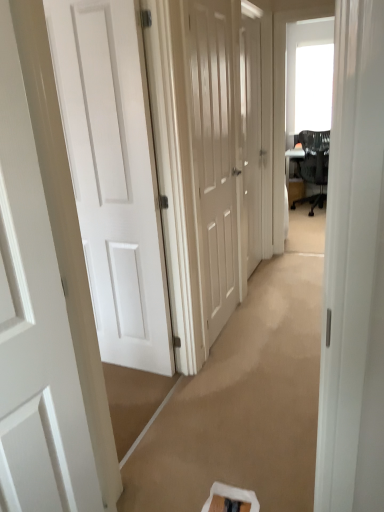
Question: Is black mesh chair at upper right to the right of white matte door at left, which is the third door in back-to-front order, from the viewer's perspective?

Choices:
 (A) no
 (B) yes

Answer: (B)

Question: Is black mesh chair at upper right at the left side of white matte door at left, which is the third door in back-to-front order?

Choices:
 (A) no
 (B) yes

Answer: (A)

Question: From the image's perspective, is black mesh chair at upper right under white matte door at left, which is the third door in back-to-front order?

Choices:
 (A) yes
 (B) no

Answer: (B)

Question: Can you confirm if black mesh chair at upper right is shorter than white matte door at left, acting as the 2th door starting from the front?

Choices:
 (A) yes
 (B) no

Answer: (A)

Question: Is white matte door at left, which is the third door in back-to-front order, a part of black mesh chair at upper right?

Choices:
 (A) no
 (B) yes

Answer: (A)

Question: Considering the positions of white glossy door at left, the first door viewed from the front, and white matte door at left, acting as the 2th door starting from the front, in the image, is white glossy door at left, the first door viewed from the front, bigger or smaller than white matte door at left, acting as the 2th door starting from the front,?

Choices:
 (A) big
 (B) small

Answer: (B)

Question: From their relative heights in the image, would you say white glossy door at left, the first door viewed from the front, is taller or shorter than white matte door at left, acting as the 2th door starting from the front?

Choices:
 (A) short
 (B) tall

Answer: (A)

Question: From a real-world perspective, relative to white matte door at left, which is the third door in back-to-front order, is white glossy door at left, the first door viewed from the front, vertically above or below?

Choices:
 (A) above
 (B) below

Answer: (B)

Question: Considering the positions of white glossy door at left, which is the fourth door in back-to-front order, and white matte door at left, acting as the 2th door starting from the front, in the image, is white glossy door at left, which is the fourth door in back-to-front order, wider or thinner than white matte door at left, acting as the 2th door starting from the front,?

Choices:
 (A) thin
 (B) wide

Answer: (A)

Question: Is white glossy door at center, which appears as the 1th door when viewed from the back, inside the boundaries of white matte door at left, which is the third door in back-to-front order, or outside?

Choices:
 (A) outside
 (B) inside

Answer: (A)

Question: From the image's perspective, relative to white matte door at left, which is the third door in back-to-front order, is white glossy door at center, which appears as the 1th door when viewed from the back, above or below?

Choices:
 (A) below
 (B) above

Answer: (B)

Question: Looking at the image, does white glossy door at center, which is the 4th door in front-to-back order, seem bigger or smaller compared to white matte door at left, which is the third door in back-to-front order?

Choices:
 (A) small
 (B) big

Answer: (A)

Question: Is white glossy door at center, which is the 4th door in front-to-back order, taller or shorter than white matte door at left, acting as the 2th door starting from the front?

Choices:
 (A) tall
 (B) short

Answer: (A)

Question: Is white matte door at left, which is the third door in back-to-front order, inside or outside of white glossy door at center, which is the 4th door in front-to-back order?

Choices:
 (A) outside
 (B) inside

Answer: (A)

Question: In terms of height, does white matte door at left, acting as the 2th door starting from the front, look taller or shorter compared to white glossy door at center, which appears as the 1th door when viewed from the back?

Choices:
 (A) short
 (B) tall

Answer: (A)